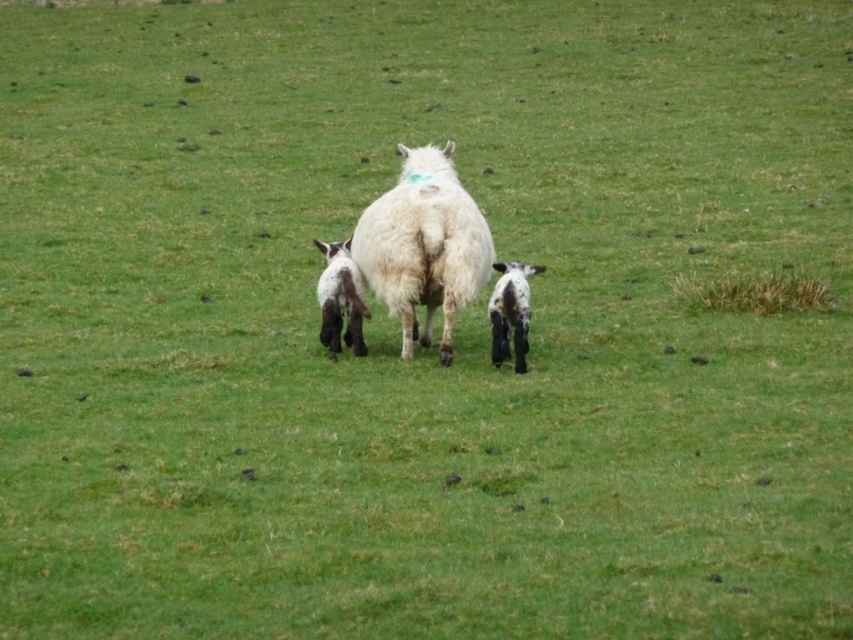
Which is behind, point (447, 317) or point (490, 323)?

Point (490, 323)

Does point (430, 150) come closer to viewer compared to point (512, 269)?

No, (430, 150) is behind (512, 269).

Where is `white fluffy sheep at center`? white fluffy sheep at center is located at coordinates (424, 246).

Can you confirm if white fluffy sheep at center is smaller than black woolen lamb at center?

No, white fluffy sheep at center is not smaller than black woolen lamb at center.

The height and width of the screenshot is (640, 853). I want to click on white fluffy sheep at center, so click(x=424, y=246).

Where is `white fluffy sheep at center`? This screenshot has height=640, width=853. white fluffy sheep at center is located at coordinates (424, 246).

Between black woolen lamb at center and black woolen goat at center, which one appears on the left side from the viewer's perspective?

black woolen lamb at center is more to the left.

Does point (328, 310) come behind point (492, 317)?

Yes, it is behind point (492, 317).

Where is `black woolen lamb at center`? The image size is (853, 640). black woolen lamb at center is located at coordinates (340, 298).